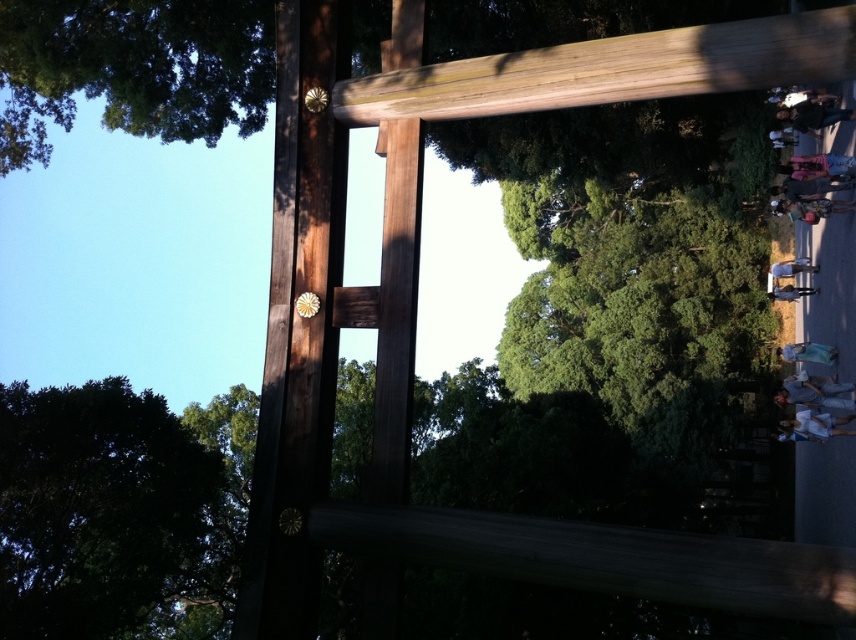
Who is lower down, green leafy tree at upper left or dark green leafy tree at lower left?

Positioned lower is dark green leafy tree at lower left.

Does green leafy tree at upper left have a lesser height compared to dark green leafy tree at lower left?

Incorrect, green leafy tree at upper left's height does not fall short of dark green leafy tree at lower left's.

Does point (364, 19) come closer to viewer compared to point (94, 468)?

No, it is behind (94, 468).

This screenshot has width=856, height=640. I want to click on green leafy tree at upper left, so click(134, 68).

Can you confirm if green leafy tree at upper left is shorter than light brown wood beam at upper center?

No, green leafy tree at upper left is not shorter than light brown wood beam at upper center.

Is green leafy tree at upper left to the left of light brown wood beam at upper center from the viewer's perspective?

Correct, you'll find green leafy tree at upper left to the left of light brown wood beam at upper center.

Does point (49, 19) lie behind point (355, 112)?

Yes, it is.

Locate an element on the screen. This screenshot has height=640, width=856. green leafy tree at upper left is located at coordinates (134, 68).

Can you confirm if dark green leafy tree at lower left is positioned to the left of light brown wood beam at upper center?

Correct, you'll find dark green leafy tree at lower left to the left of light brown wood beam at upper center.

Consider the image. Between dark green leafy tree at lower left and light brown wood beam at upper center, which one appears on the right side from the viewer's perspective?

From the viewer's perspective, light brown wood beam at upper center appears more on the right side.

Between point (122, 468) and point (581, 60), which one is positioned in front?

Point (122, 468) is more forward.

Identify the location of dark green leafy tree at lower left. The image size is (856, 640). (98, 508).